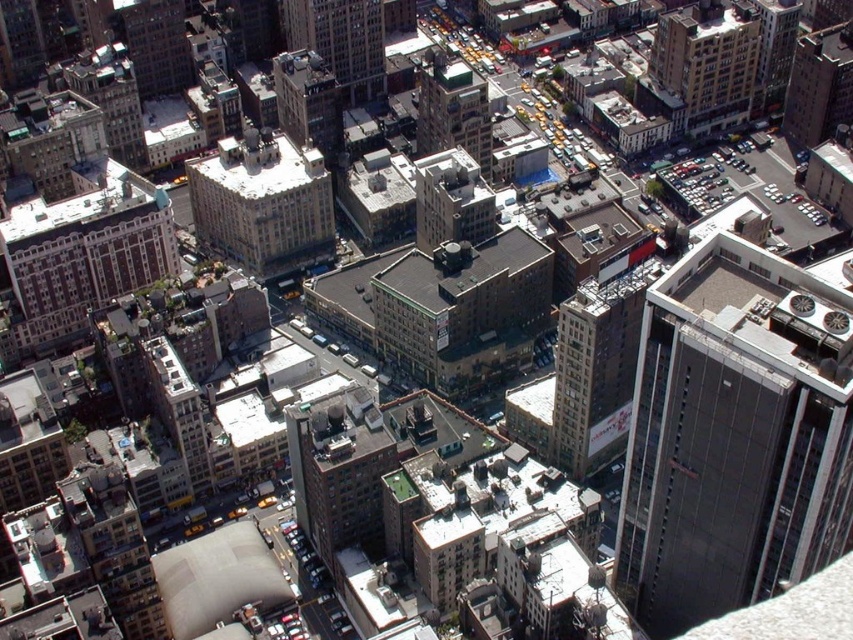
Which of these two, brown brick building at upper right or matte gray building at upper left, stands shorter?

Standing shorter between the two is matte gray building at upper left.

In the scene shown: How far apart are brown brick building at upper right and matte gray building at upper left?

brown brick building at upper right is 778.55 feet away from matte gray building at upper left.

Find the location of a particular element. Image resolution: width=853 pixels, height=640 pixels. brown brick building at upper right is located at coordinates (705, 67).

Is white stone building at left thinner than white stone building at center?

In fact, white stone building at left might be wider than white stone building at center.

What are the coordinates of `white stone building at left` in the screenshot? It's located at (84, 253).

You are a GUI agent. You are given a task and a screenshot of the screen. Output one action in this format:
    pyautogui.click(x=<x>, y=<y>)
    Task: Click on the white stone building at left
    
    Given the screenshot: What is the action you would take?
    pyautogui.click(x=84, y=253)

Measure the distance between point (589, 330) and camera.

Point (589, 330) and camera are 964.50 feet apart from each other.

Is point (612, 355) closer to viewer compared to point (434, 120)?

Yes.

This screenshot has width=853, height=640. In order to click on dark gray concrete building at center in this screenshot , I will do (x=596, y=371).

In order to click on dark gray concrete building at center in this screenshot , I will do `click(596, 371)`.